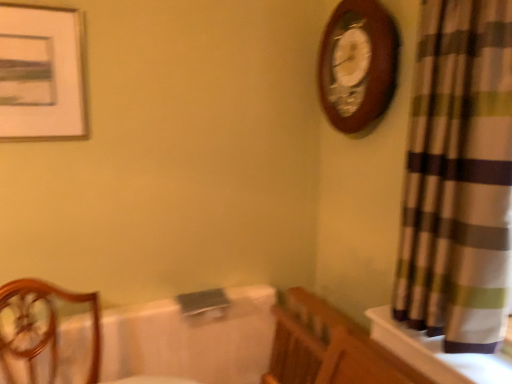
Question: Is matte white picture frame at upper left wider or thinner than wooden chair at left?

Choices:
 (A) wide
 (B) thin

Answer: (B)

Question: From the image's perspective, is matte white picture frame at upper left above or below wooden chair at left?

Choices:
 (A) below
 (B) above

Answer: (B)

Question: Considering the real-world distances, which object is farthest from the wooden wall clock at upper right?

Choices:
 (A) wooden chair at left
 (B) white glossy bath at center
 (C) matte white picture frame at upper left
 (D) plaid fabric curtain at right

Answer: (A)

Question: Estimate the real-world distances between objects in this image. Which object is closer to the wooden chair at left?

Choices:
 (A) matte white picture frame at upper left
 (B) wooden wall clock at upper right
 (C) plaid fabric curtain at right
 (D) white glossy bath at center

Answer: (D)